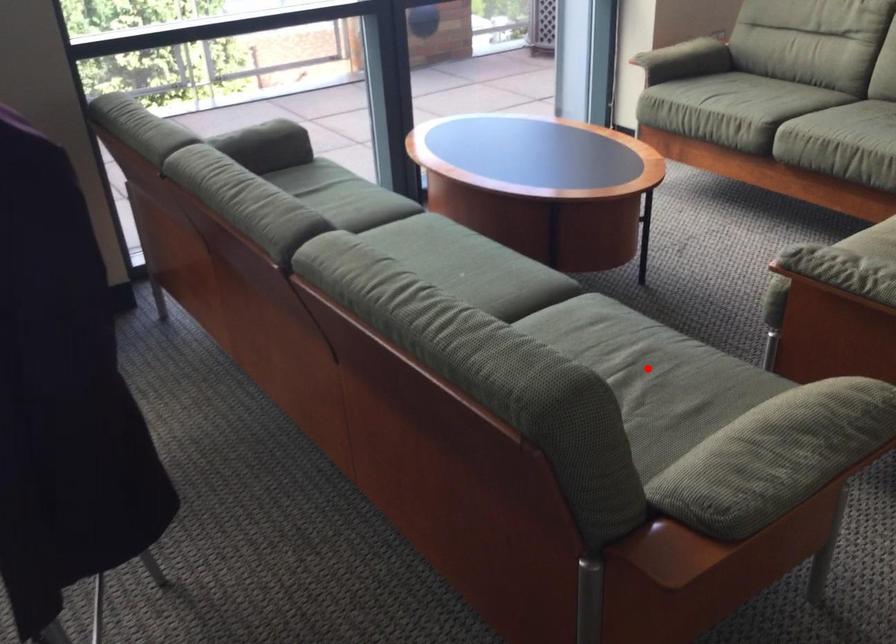
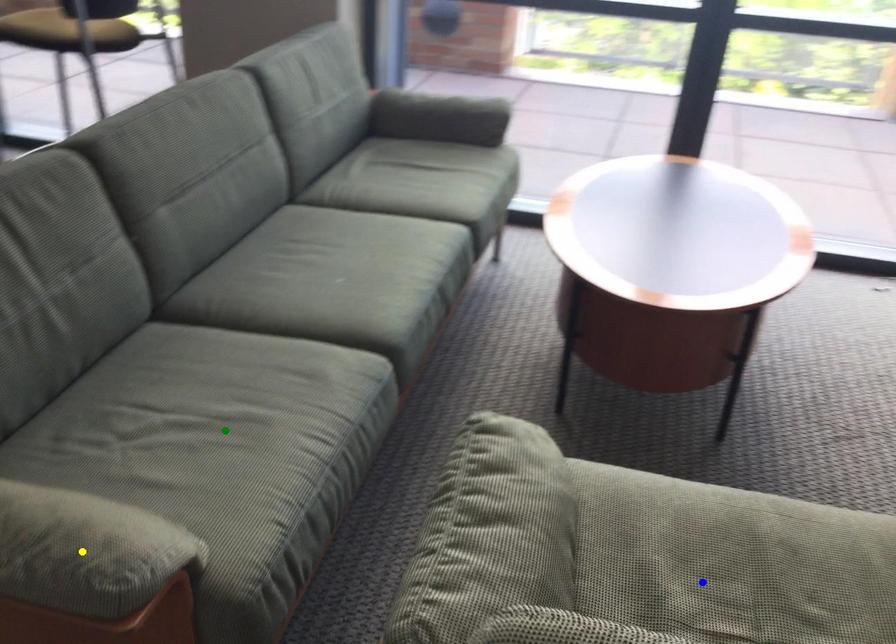
Question: I am providing you with two images of the same scene from different viewpoints. A red point is marked on the first image. You are given multiple points on the second image. Which spot in image 2 lines up with the point in image 1?

Choices:
 (A) blue point
 (B) yellow point
 (C) green point

Answer: (C)